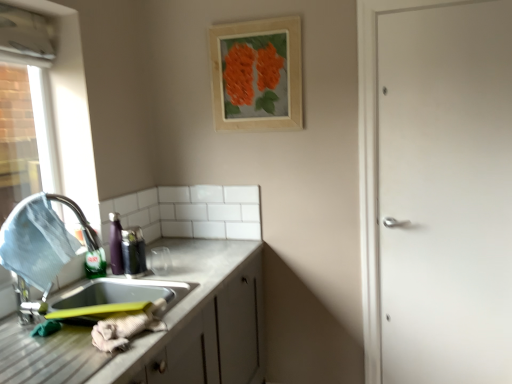
Find the location of a particular element. free location above white matte door at right (from a real-world perspective) is located at coordinates (429, 4).